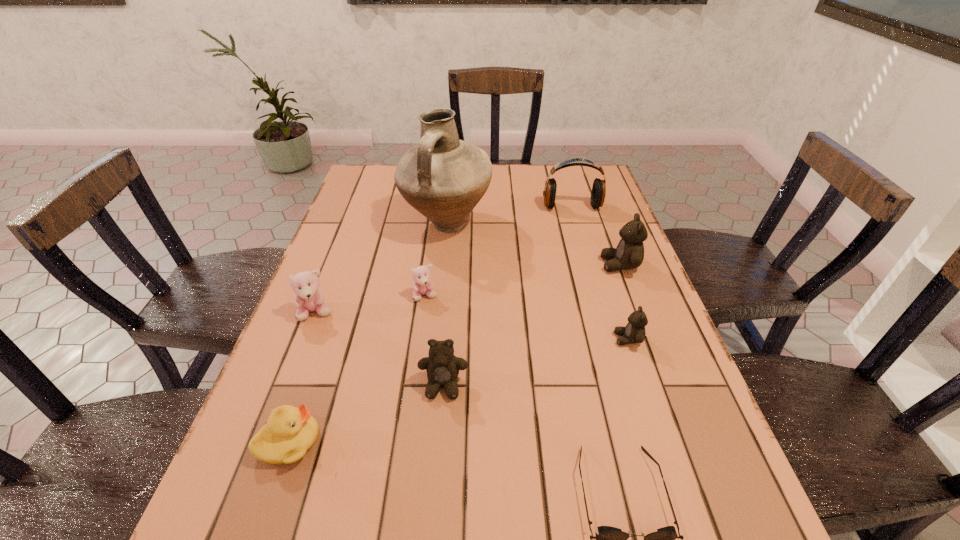
In the image, there is a desktop. Identify the location of free region at the near right corner. (698, 537).

I want to click on vacant space that's between the farthest brown teddy bear and the duckling, so (454, 353).

You are a GUI agent. You are given a task and a screenshot of the screen. Output one action in this format:
    pyautogui.click(x=<x>, y=<y>)
    Task: Click on the free space between the farthest brown teddy bear and the second biggest brown teddy bear
    This screenshot has height=540, width=960.
    Given the screenshot: What is the action you would take?
    pyautogui.click(x=532, y=325)

At what (x,y) coordinates should I click in order to perform the action: click on unoccupied area between the leftmost brown teddy bear and the yellow duckling. Please return your answer as a coordinate pair (x, y). Looking at the image, I should click on (367, 414).

You are a GUI agent. You are given a task and a screenshot of the screen. Output one action in this format:
    pyautogui.click(x=<x>, y=<y>)
    Task: Click on the free space between the farthest brown teddy bear and the tallest object
    The height and width of the screenshot is (540, 960).
    Given the screenshot: What is the action you would take?
    pyautogui.click(x=533, y=245)

The width and height of the screenshot is (960, 540). What are the coordinates of `empty space that is in between the tallest object and the fourth farthest teddy bear` in the screenshot? It's located at (537, 282).

Where is `vacant area that lies between the headset and the third nearest object`? vacant area that lies between the headset and the third nearest object is located at coordinates (508, 296).

At what (x,y) coordinates should I click in order to perform the action: click on free point between the smallest brown teddy bear and the leftmost teddy bear. Please return your answer as a coordinate pair (x, y). The image size is (960, 540). Looking at the image, I should click on (472, 326).

Identify which object is located as the second nearest to the smallest brown teddy bear. Please provide its 2D coordinates. Your answer should be formatted as a tuple, i.e. [(x, y)], where the tuple contains the x and y coordinates of a point satisfying the conditions above.

[(609, 539)]

Image resolution: width=960 pixels, height=540 pixels. What are the coordinates of `object that is the eighth closest to the pitcher` in the screenshot? It's located at (609, 539).